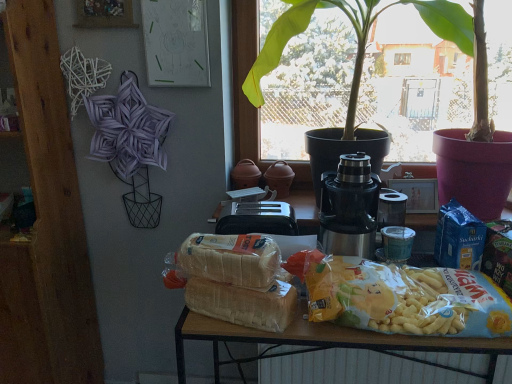
Question: From the image's perspective, is satin silver thermos at center, placed as the 2th yoghurt when sorted from right to left, located above or below matte plastic table at center?

Choices:
 (A) above
 (B) below

Answer: (A)

Question: Is satin silver thermos at center, placed as the 2th yoghurt when sorted from right to left, spatially inside matte plastic table at center, or outside of it?

Choices:
 (A) outside
 (B) inside

Answer: (A)

Question: Estimate the real-world distances between objects in this image. Which object is closer to the translucent plastic bag of chips at center, which is counted as the 3th yoghurt, starting from the right?

Choices:
 (A) yellow matte snack at center
 (B) wooden bookshelf at left
 (C) matte plastic table at center
 (D) satin silver thermos at center, the second yoghurt from the left
 (E) green leafy plant at center

Answer: (C)

Question: Estimate the real-world distances between objects in this image. Which object is farther from the yellow matte snack at center?

Choices:
 (A) white textured radiator at lower center
 (B) green leafy plant at center
 (C) matte paper drawing at upper center
 (D) translucent plastic bag of chips at center, arranged as the first yoghurt when viewed from the left
 (E) blue foil packet at right, acting as the third yoghurt starting from the left

Answer: (C)